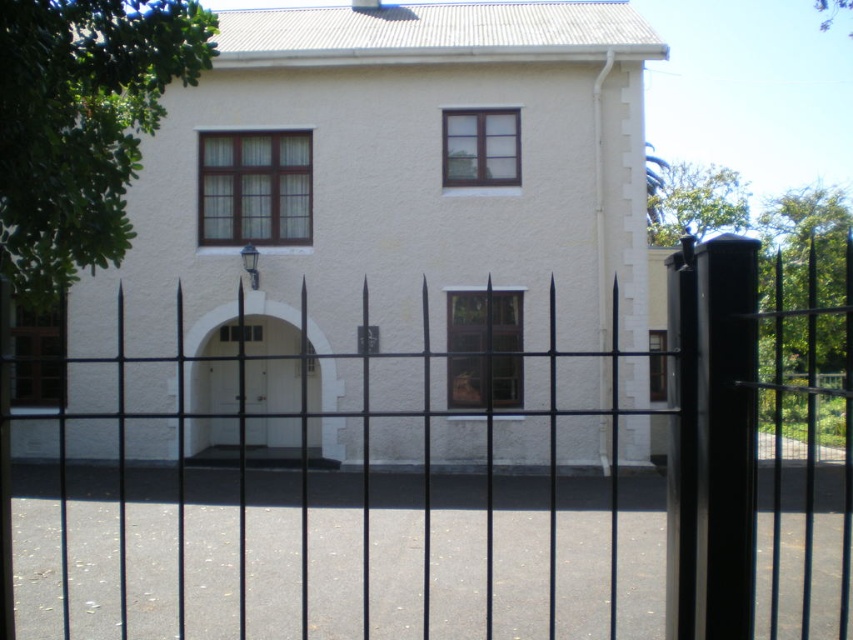
Does black metal fence at center appear on the right side of white matte door at center?

Indeed, black metal fence at center is positioned on the right side of white matte door at center.

Is black metal fence at center to the left of white matte door at center from the viewer's perspective?

Incorrect, black metal fence at center is not on the left side of white matte door at center.

Is point (157, 544) positioned after point (224, 385)?

No, it is not.

The height and width of the screenshot is (640, 853). Find the location of `black metal fence at center`. black metal fence at center is located at coordinates (463, 497).